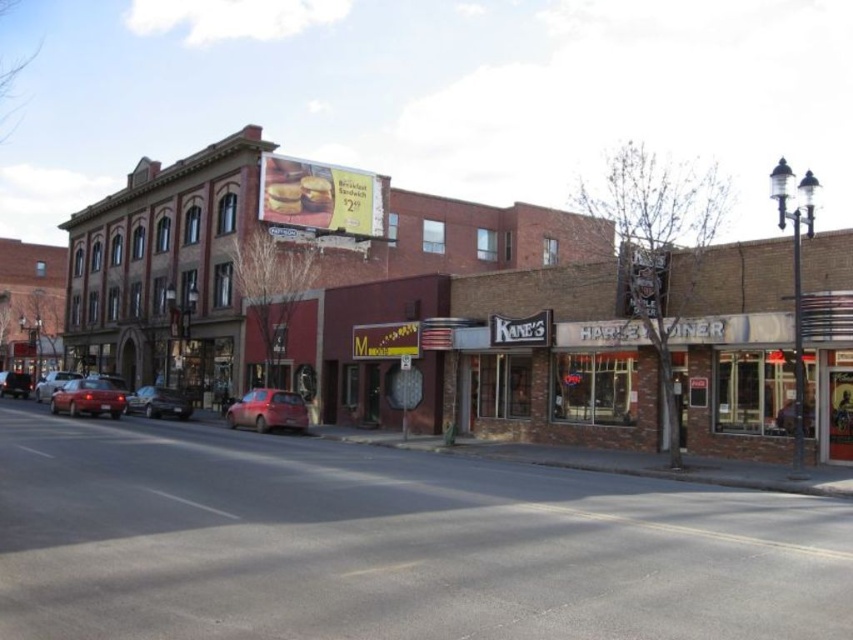
You are a pedestrian standing at the edge of the street. You see a matte red sedan at lower left and a matte red car at center. Which one is nearer to you?

The matte red sedan at lower left is closer to the viewer than the matte red car at center, so the matte red sedan at lower left is nearer to you.

You are standing at the point marked by coordinates point (x=432, y=314) in the image. Which building are you facing? Please answer with the object label from the scene description.

The brick building at center is represented by point (x=432, y=314), so you are facing the brick building at center.